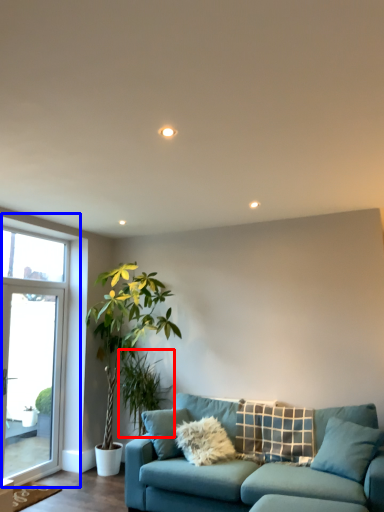
Question: Which object is further to the camera taking this photo, plant (highlighted by a red box) or window (highlighted by a blue box)?

Choices:
 (A) plant
 (B) window

Answer: (A)